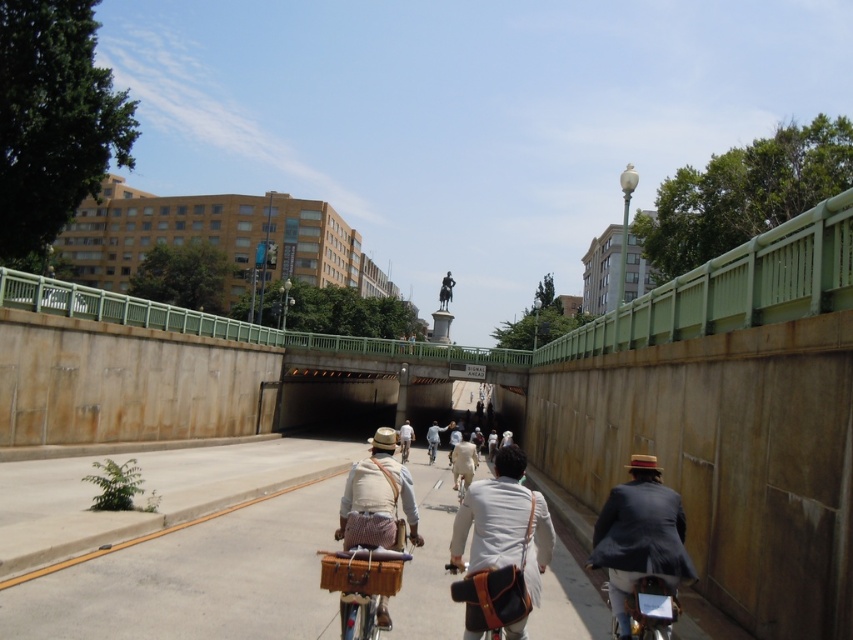
You are a cyclist planning to ride through the scene. You notice the smooth concrete bike lane at center and the light brown leather jacket at center. Which object takes up more space in the image?

The smooth concrete bike lane at center is larger in size than the light brown leather jacket at center, so the smooth concrete bike lane at center takes up more space in the image.

From the picture: You are a photographer standing on the bridge. You notice two people below wearing the dark blue suit at right and the light brown leather jacket at center. Which person appears wider in the photo?

The light brown leather jacket at center appears wider in the photo since the dark blue suit at right has a lesser width compared to it.

You are a cyclist approaching the smooth concrete bike lane at center and notice a white leather jacket at center on the path. Is there enough space to safely maneuver around the jacket without leaving the bike lane?

The smooth concrete bike lane at center has a larger size compared to the white leather jacket at center, so there should be enough space to safely maneuver around the jacket while staying within the bike lane.